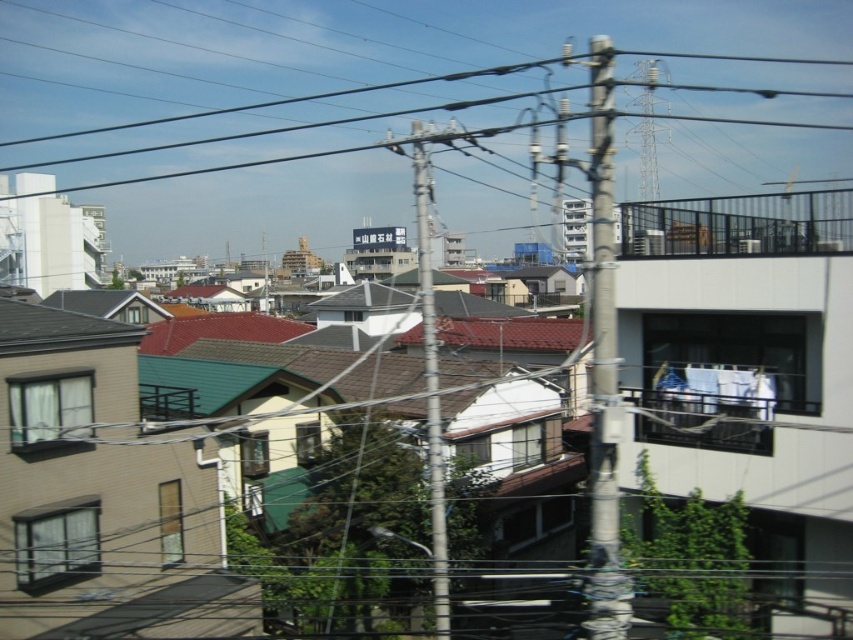
Question: Which of the following is the farthest from the observer?

Choices:
 (A) (105, 324)
 (B) (596, 198)
 (C) (450, 342)

Answer: (C)

Question: Is the position of metallic gray telegraph pole at upper right more distant than that of shiny black roof at upper left?

Choices:
 (A) yes
 (B) no

Answer: (B)

Question: Does metallic gray telegraph pole at upper right appear on the right side of brown tile roof at center?

Choices:
 (A) no
 (B) yes

Answer: (A)

Question: Among these points, which one is farthest from the camera?

Choices:
 (A) (602, 221)
 (B) (444, 321)
 (C) (9, 349)

Answer: (B)

Question: Is metallic gray telegraph pole at upper right wider than shiny black roof at upper left?

Choices:
 (A) no
 (B) yes

Answer: (B)

Question: Which point is farther to the camera?

Choices:
 (A) (496, 320)
 (B) (86, 337)
 (C) (607, 104)

Answer: (A)